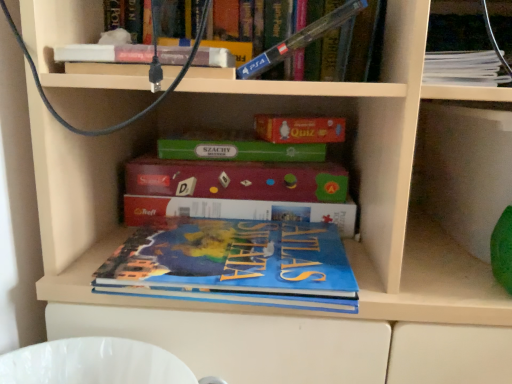
You are a GUI agent. You are given a task and a screenshot of the screen. Output one action in this format:
    pyautogui.click(x=<x>, y=<y>)
    Task: Click on the vacant region above blue matte atlas book at center, positioned as the fourth book in top-to-bottom order (from a real-world perspective)
    
    Given the screenshot: What is the action you would take?
    pyautogui.click(x=240, y=246)